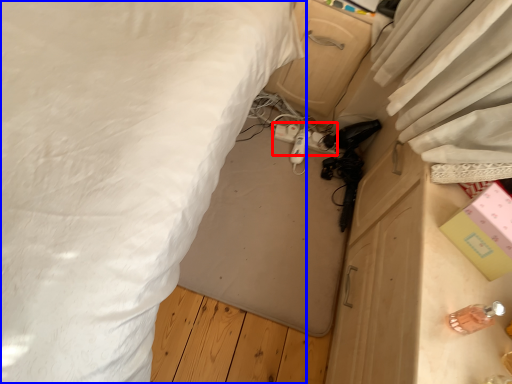
Question: Which object is closer to the camera taking this photo, extension cord (highlighted by a red box) or bed (highlighted by a blue box)?

Choices:
 (A) extension cord
 (B) bed

Answer: (B)